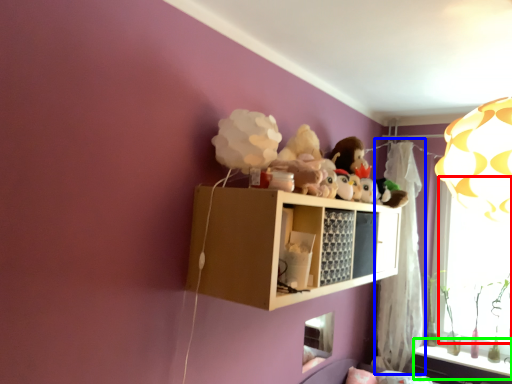
Question: Based on their relative distances, which object is farther from window screen (highlighted by a red box)? Choose from curtain (highlighted by a blue box) and window sill (highlighted by a green box).

Choices:
 (A) curtain
 (B) window sill

Answer: (B)